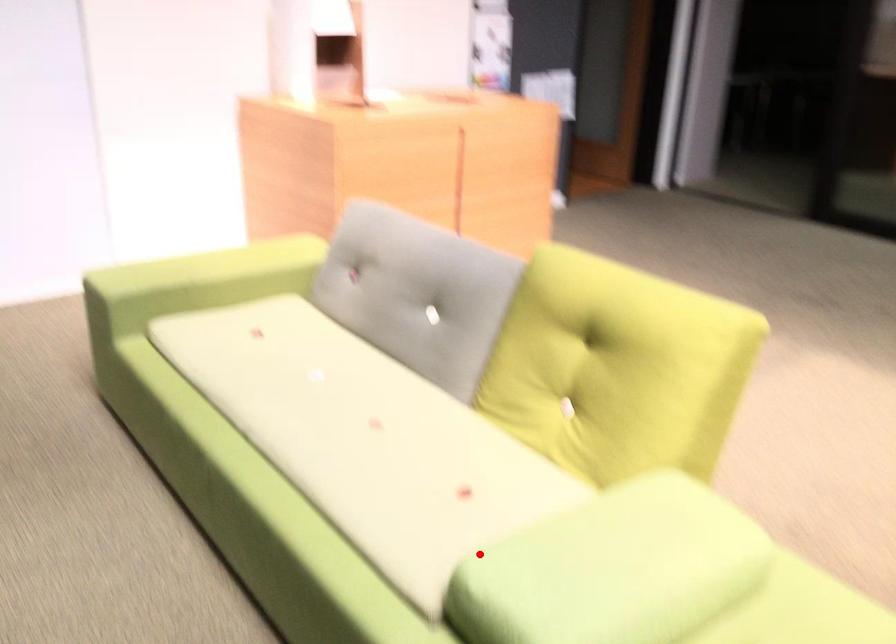
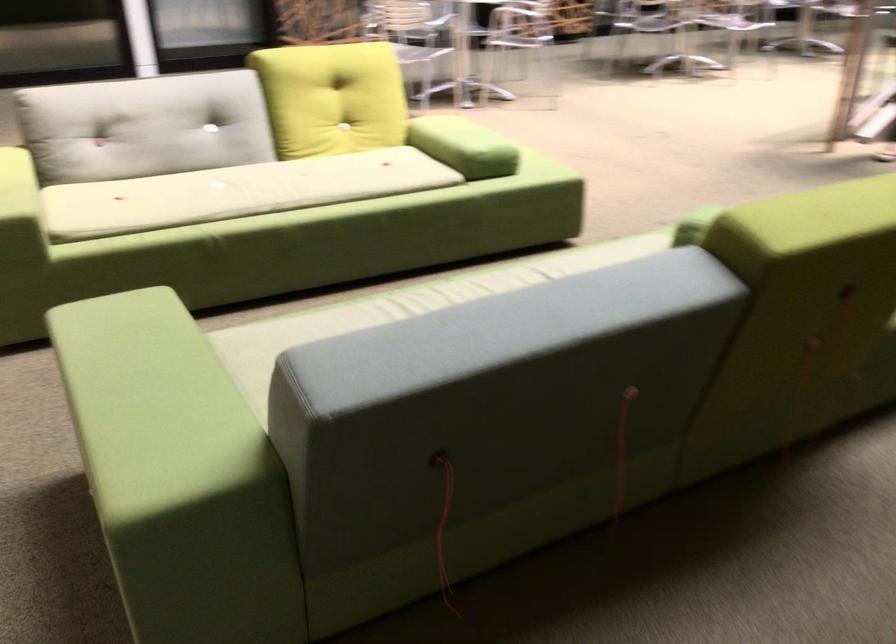
Where in the second image is the point corresponding to the highlighted location from the first image?

(464, 146)